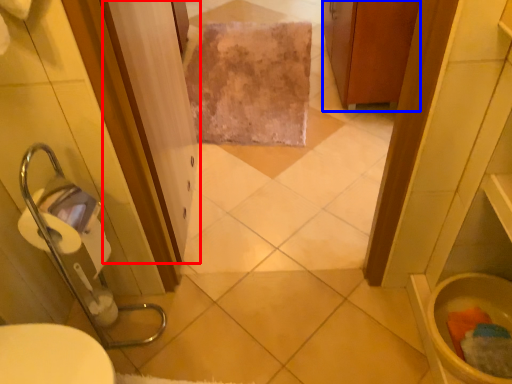
Question: Which of the following is the closest to the observer, screen door (highlighted by a red box) or cabinetry (highlighted by a blue box)?

Choices:
 (A) screen door
 (B) cabinetry

Answer: (A)